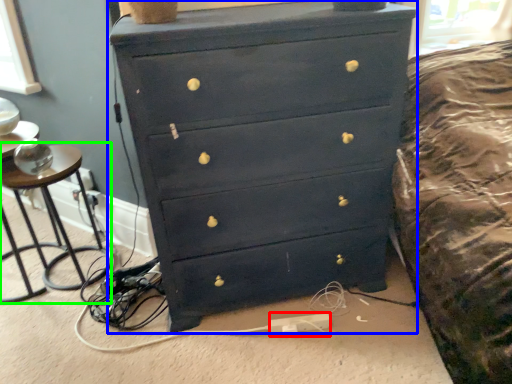
Question: Estimate the real-world distances between objects in this image. Which object is closer to extension cord (highlighted by a red box), chest of drawers (highlighted by a blue box) or side table (highlighted by a green box)?

Choices:
 (A) chest of drawers
 (B) side table

Answer: (A)